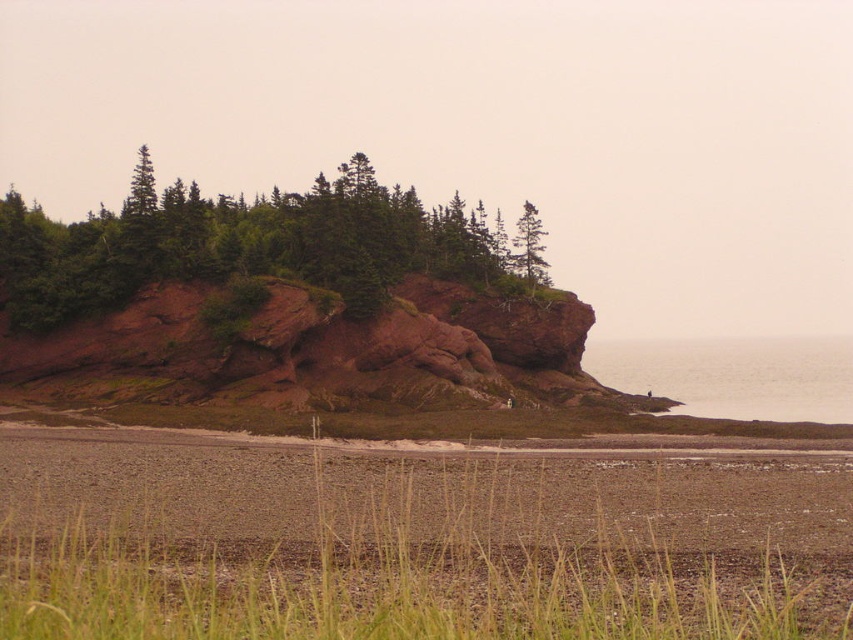
Question: Does green matte rock at center have a lesser width compared to green matte tree at upper center?

Choices:
 (A) no
 (B) yes

Answer: (A)

Question: Does green matte rock at center have a greater width compared to clear water at lower right?

Choices:
 (A) no
 (B) yes

Answer: (A)

Question: Among these points, which one is farthest from the camera?

Choices:
 (A) (318, 500)
 (B) (537, 225)
 (C) (787, 406)

Answer: (C)

Question: Which object is farther from the camera taking this photo?

Choices:
 (A) green matte rock at center
 (B) brown gravel beach at lower center
 (C) clear water at lower right
 (D) green matte tree at upper center

Answer: (D)

Question: Can you confirm if brown gravel beach at lower center is positioned below clear water at lower right?

Choices:
 (A) yes
 (B) no

Answer: (B)

Question: Which point is farther to the camera?

Choices:
 (A) (738, 572)
 (B) (105, 228)
 (C) (541, 243)
 (D) (695, 385)

Answer: (D)